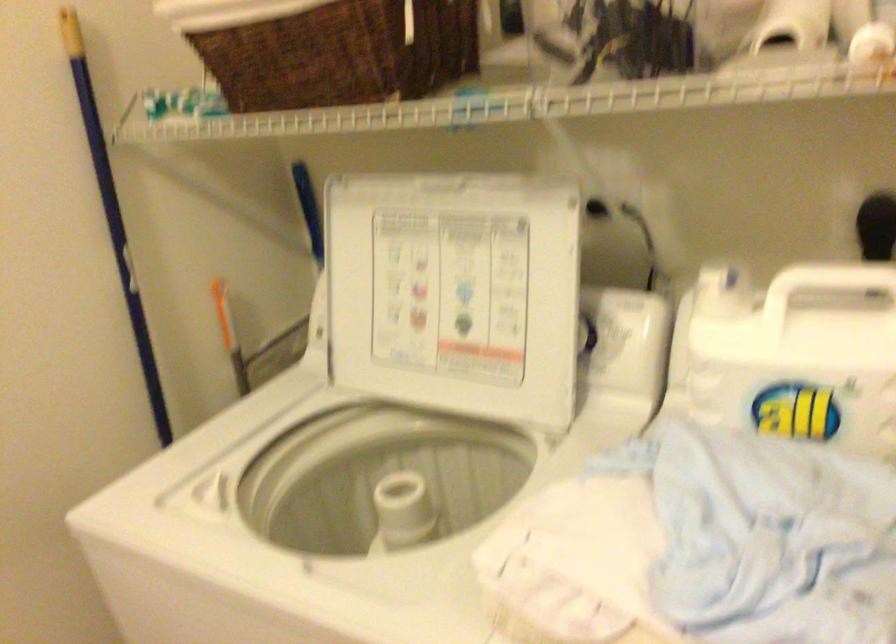
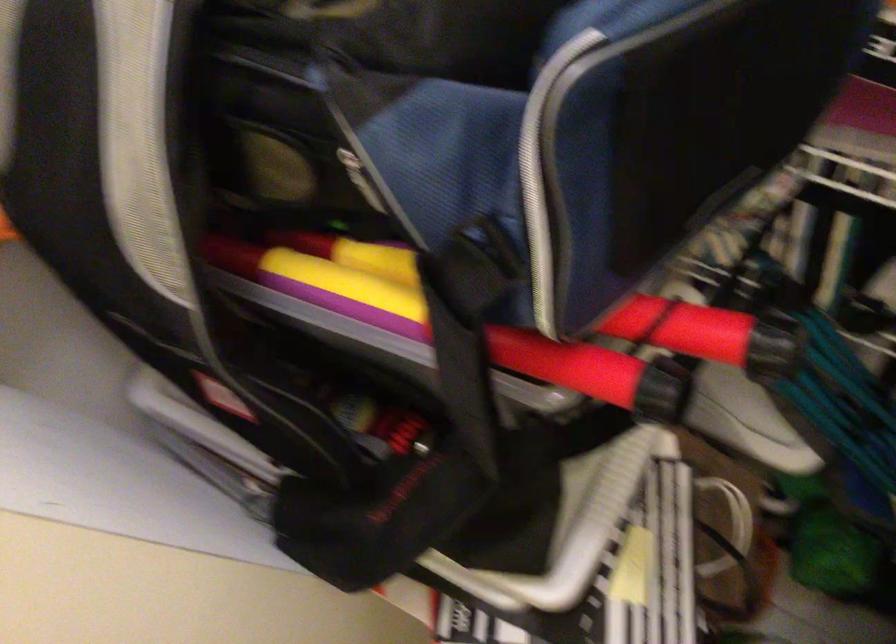
First-person continuous shooting, in which direction is the camera rotating?

The camera's rotation is toward right-down.